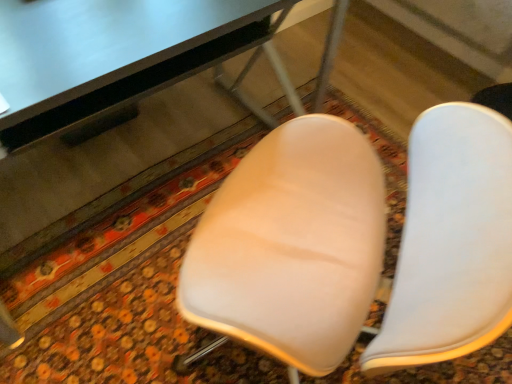
Describe the element at coordinates (451, 241) in the screenshot. I see `white matte chair at center` at that location.

Locate an element on the screen. The image size is (512, 384). white matte chair at center is located at coordinates (451, 241).

Where is `matte black table at upper center`? Image resolution: width=512 pixels, height=384 pixels. matte black table at upper center is located at coordinates pyautogui.click(x=120, y=59).

Describe the element at coordinates (120, 59) in the screenshot. Image resolution: width=512 pixels, height=384 pixels. I see `matte black table at upper center` at that location.

What is the approximate height of matte black table at upper center?

29.84 inches.

This screenshot has width=512, height=384. I want to click on white matte chair at center, so click(451, 241).

Which is more to the left, white matte chair at center or matte black table at upper center?

matte black table at upper center is more to the left.

Does white matte chair at center lie in front of matte black table at upper center?

No, it is not.

Considering the positions of points (429, 308) and (66, 92), is point (429, 308) farther from camera compared to point (66, 92)?

No, (429, 308) is closer to viewer.

From the image's perspective, is white matte chair at center above or below matte black table at upper center?

white matte chair at center is situated lower than matte black table at upper center in the image.

From a real-world perspective, which object rests below the other?

white matte chair at center, from a real-world perspective.

Is white matte chair at center wider or thinner than matte black table at upper center?

In the image, white matte chair at center appears to be wider than matte black table at upper center.

From their relative heights in the image, would you say white matte chair at center is taller or shorter than matte black table at upper center?

Considering their sizes, white matte chair at center has less height than matte black table at upper center.

Considering the sizes of objects white matte chair at center and matte black table at upper center in the image provided, who is smaller, white matte chair at center or matte black table at upper center?

With smaller size is white matte chair at center.

Is white matte chair at center inside the boundaries of matte black table at upper center, or outside?

The correct answer is: outside.

Would you say white matte chair at center is a long distance from matte black table at upper center?

No, there isn't a large distance between white matte chair at center and matte black table at upper center.

Is white matte chair at center looking in the opposite direction of matte black table at upper center?

Yes.

Where is `chair behind the matte black table at upper center`? chair behind the matte black table at upper center is located at coordinates (451, 241).

Which is more to the left, matte black table at upper center or white matte chair at center?

Positioned to the left is matte black table at upper center.

Considering the positions of objects matte black table at upper center and white matte chair at center in the image provided, who is in front, matte black table at upper center or white matte chair at center?

matte black table at upper center is more forward.

Is point (143, 62) positioned after point (457, 154)?

Yes, point (143, 62) is behind point (457, 154).

From the image's perspective, who appears lower, matte black table at upper center or white matte chair at center?

white matte chair at center, from the image's perspective.

From a real-world perspective, between matte black table at upper center and white matte chair at center, who is vertically lower?

white matte chair at center is physically lower.

Can you confirm if matte black table at upper center is thinner than white matte chair at center?

Correct, the width of matte black table at upper center is less than that of white matte chair at center.

Between matte black table at upper center and white matte chair at center, which one has less height?

white matte chair at center is shorter.

Considering the relative sizes of matte black table at upper center and white matte chair at center in the image provided, is matte black table at upper center bigger than white matte chair at center?

Yes.

Is matte black table at upper center situated inside white matte chair at center or outside?

matte black table at upper center is located beyond the bounds of white matte chair at center.

Is matte black table at upper center beside white matte chair at center?

matte black table at upper center and white matte chair at center are not in contact.

Is white matte chair at center at the back of matte black table at upper center?

No, matte black table at upper center is not facing the opposite direction of white matte chair at center.

How many degrees apart are the facing directions of matte black table at upper center and white matte chair at center?

0.771 degrees.

I want to click on table on the left of white matte chair at center, so click(x=120, y=59).

Where is `table that is in front of the white matte chair at center`? table that is in front of the white matte chair at center is located at coordinates (120, 59).

Where is `chair beneath the matte black table at upper center (from a real-world perspective)`? The height and width of the screenshot is (384, 512). chair beneath the matte black table at upper center (from a real-world perspective) is located at coordinates (451, 241).